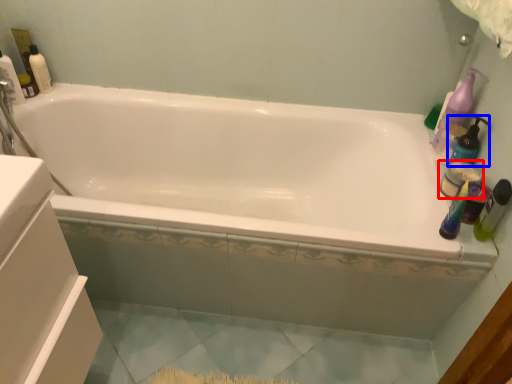
Question: Which of the following is the farthest to the observer, toiletry (highlighted by a red box) or cleaning product (highlighted by a blue box)?

Choices:
 (A) toiletry
 (B) cleaning product

Answer: (A)